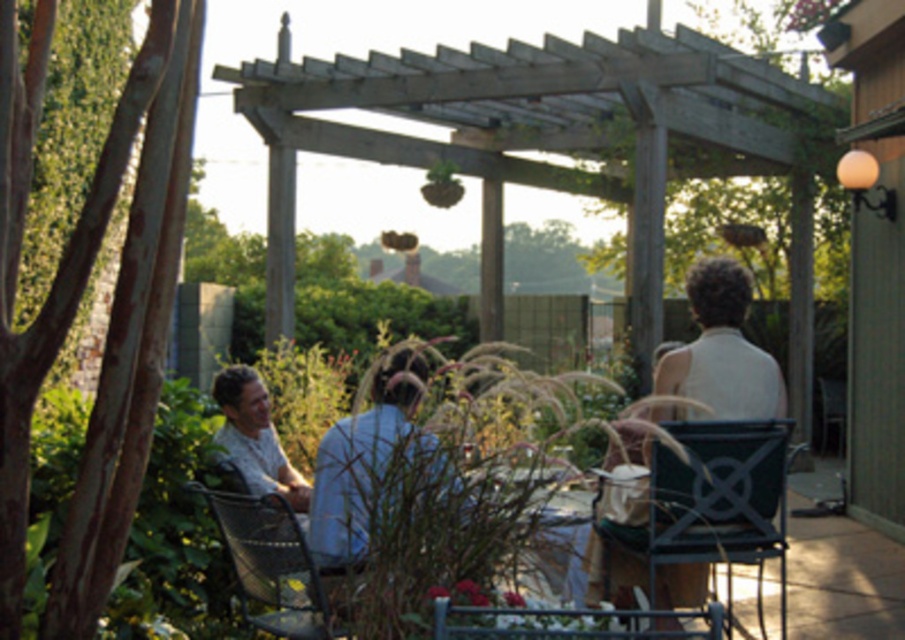
Question: Is metallic silver chair at lower center behind wooden table at center?

Choices:
 (A) no
 (B) yes

Answer: (A)

Question: Which point is farther to the camera?

Choices:
 (A) metallic silver chair at lower center
 (B) metallic silver chair at lower left
 (C) metallic black chair at right
 (D) wooden table at center

Answer: (C)

Question: Which point is closer to the camera taking this photo?

Choices:
 (A) coord(659,547)
 (B) coord(561,516)
 (C) coord(336,625)
 (D) coord(510,608)

Answer: (D)

Question: Can you confirm if metallic silver chair at lower center is positioned to the left of wooden table at center?

Choices:
 (A) no
 (B) yes

Answer: (A)

Question: Which object is closer to the camera taking this photo?

Choices:
 (A) metallic black chair at right
 (B) metallic silver chair at lower center

Answer: (B)

Question: Can you confirm if metallic silver chair at lower left is positioned below wooden table at center?

Choices:
 (A) no
 (B) yes

Answer: (B)